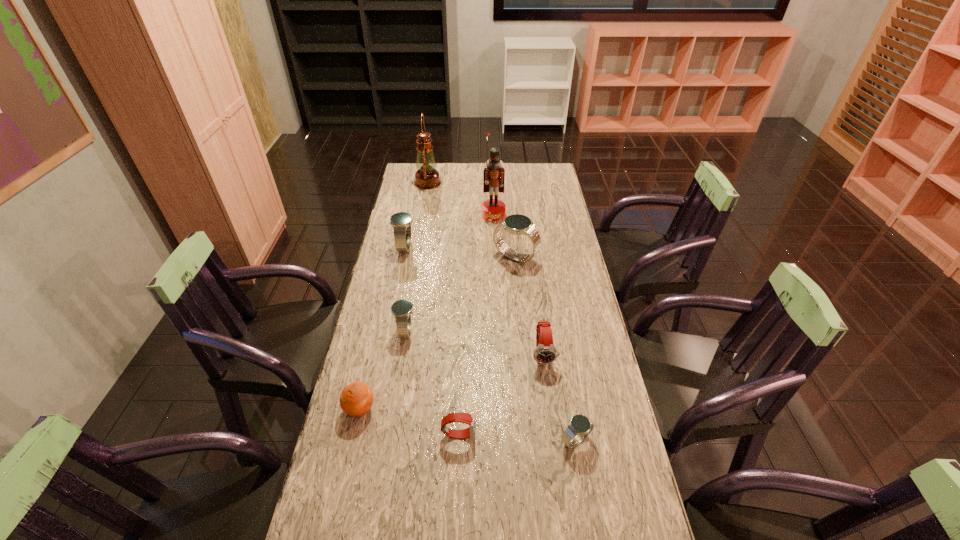
Identify the location of the fifth object from right to left. (470, 419).

At what (x,y) coordinates should I click in order to perform the action: click on the left red watch. Please return your answer as a coordinate pair (x, y). Looking at the image, I should click on (470, 419).

In order to click on the smallest blue watch in this screenshot , I will do `click(580, 426)`.

The image size is (960, 540). In order to click on vacant position located 0.310m on the front-facing side of the second farthest object in this screenshot , I will do `click(495, 268)`.

Where is `free space located 0.050m on the right of the farthest object`? This screenshot has height=540, width=960. free space located 0.050m on the right of the farthest object is located at coordinates (451, 183).

Find the location of `vacant space located 0.150m on the left of the seventh shortest object`. vacant space located 0.150m on the left of the seventh shortest object is located at coordinates (455, 257).

Locate an element on the screen. free space located 0.370m on the right of the third smallest blue watch is located at coordinates (508, 247).

At what (x,y) coordinates should I click in order to perform the action: click on free location located on the face of the bigger red watch. Please return your answer as a coordinate pair (x, y). This screenshot has height=540, width=960. Looking at the image, I should click on (559, 471).

You are a GUI agent. You are given a task and a screenshot of the screen. Output one action in this format:
    pyautogui.click(x=<x>, y=<y>)
    Task: Click on the vacant position located on the right of the second nearest blue watch
    Image resolution: width=960 pixels, height=540 pixels.
    Given the screenshot: What is the action you would take?
    click(463, 331)

Locate an element on the screen. The height and width of the screenshot is (540, 960). vacant space located on the back of the orange orange is located at coordinates (367, 380).